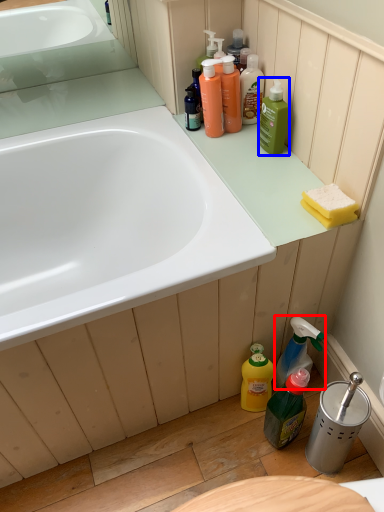
Question: Which object is closer to the camera taking this photo, cleaning product (highlighted by a red box) or cleaning product (highlighted by a blue box)?

Choices:
 (A) cleaning product
 (B) cleaning product

Answer: (A)